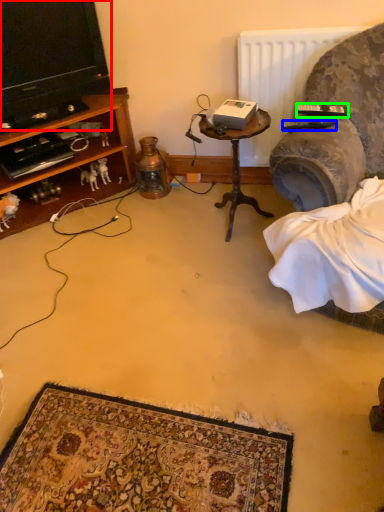
Question: Considering the real-world distances, which object is closest to television (highlighted by a red box)? remote control (highlighted by a blue box) or remote control (highlighted by a green box).

Choices:
 (A) remote control
 (B) remote control

Answer: (A)